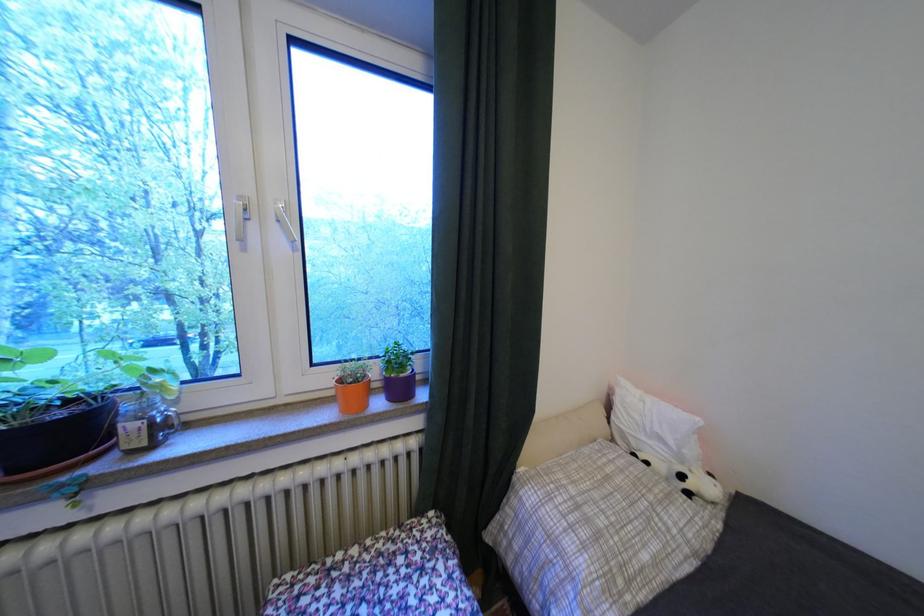
Identify the location of orange flower pot. The image size is (924, 616). (353, 386).